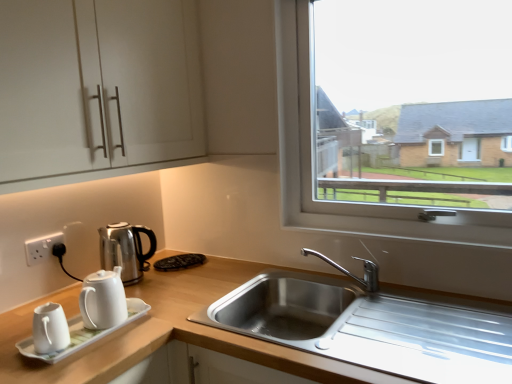
Question: From the image's perspective, is white ceramic tea set at lower left beneath white matte cabinet at upper left?

Choices:
 (A) no
 (B) yes

Answer: (B)

Question: Is the position of white ceramic tea set at lower left more distant than that of white matte cabinet at upper left?

Choices:
 (A) no
 (B) yes

Answer: (B)

Question: Can you confirm if white ceramic tea set at lower left is bigger than white matte cabinet at upper left?

Choices:
 (A) no
 (B) yes

Answer: (A)

Question: From the image's perspective, is white ceramic tea set at lower left on top of white matte cabinet at upper left?

Choices:
 (A) yes
 (B) no

Answer: (B)

Question: Does white ceramic tea set at lower left have a lesser height compared to white matte cabinet at upper left?

Choices:
 (A) yes
 (B) no

Answer: (A)

Question: From a real-world perspective, does white ceramic tea set at lower left sit lower than white matte cabinet at upper left?

Choices:
 (A) no
 (B) yes

Answer: (B)

Question: Is the depth of white ceramic tea set at lower left greater than that of white glossy coffee pot at left?

Choices:
 (A) no
 (B) yes

Answer: (A)

Question: Does white ceramic tea set at lower left have a lesser height compared to white glossy coffee pot at left?

Choices:
 (A) no
 (B) yes

Answer: (B)

Question: Can you confirm if white ceramic tea set at lower left is smaller than white glossy coffee pot at left?

Choices:
 (A) yes
 (B) no

Answer: (A)

Question: Is white ceramic tea set at lower left oriented towards white glossy coffee pot at left?

Choices:
 (A) yes
 (B) no

Answer: (B)

Question: Can you confirm if white ceramic tea set at lower left is positioned to the right of white glossy coffee pot at left?

Choices:
 (A) no
 (B) yes

Answer: (B)

Question: Does white ceramic tea set at lower left have a larger size compared to white glossy coffee pot at left?

Choices:
 (A) no
 (B) yes

Answer: (A)

Question: Can you confirm if stainless steel sink at lower center is smaller than white matte cabinet at upper left?

Choices:
 (A) no
 (B) yes

Answer: (B)